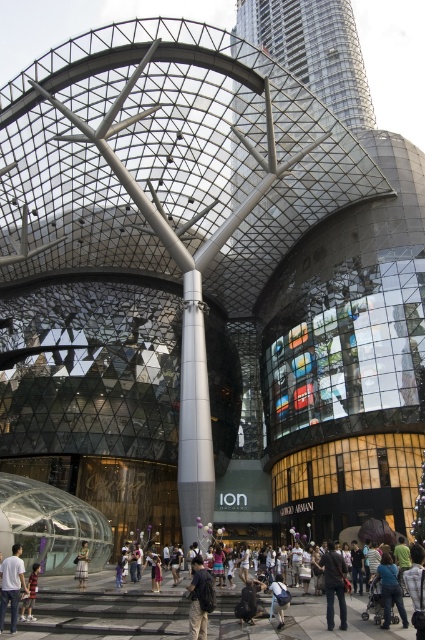
You are a delivery person standing at the entrance of the mall and need to deliver a package to the customer who is wearing khaki pants at center and dark brown leather jacket at center. The delivery robot you are using has a maximum range of 30 feet. Can the robot reach the customer?

The distance between the khaki pants at center and dark brown leather jacket at center is 30.54 feet, which exceeds the robot maximum range of 30 feet. The robot cannot reach the customer.